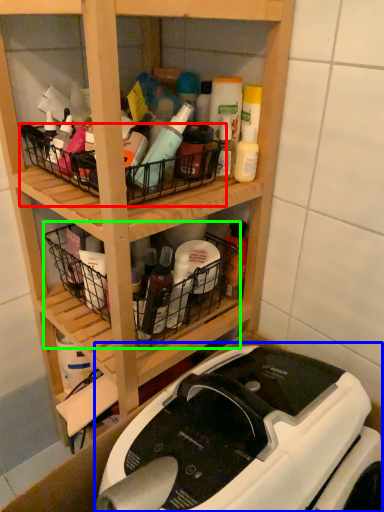
Question: Based on their relative distances, which object is nearer to basket (highlighted by a red box)? Choose from sewing machine (highlighted by a blue box) and basket (highlighted by a green box).

Choices:
 (A) sewing machine
 (B) basket

Answer: (B)